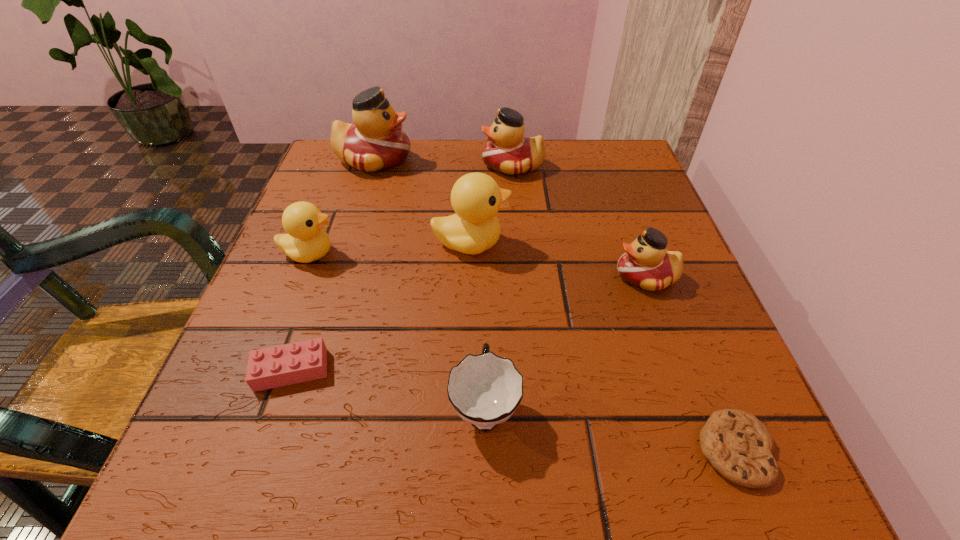
The width and height of the screenshot is (960, 540). In order to click on vacant space that satisfies the following two spatial constraints: 1. on the face of the biggest red duck; 2. on the front side of the pink Lego in this screenshot , I will do `click(308, 370)`.

The image size is (960, 540). Identify the location of vacant region that satisfies the following two spatial constraints: 1. on the face of the left yellow duck; 2. on the back side of the pink Lego. (264, 370).

Locate an element on the screen. This screenshot has width=960, height=540. vacant space that satisfies the following two spatial constraints: 1. on the side of the cup with the handle; 2. on the face of the leftmost red duck is located at coordinates (483, 159).